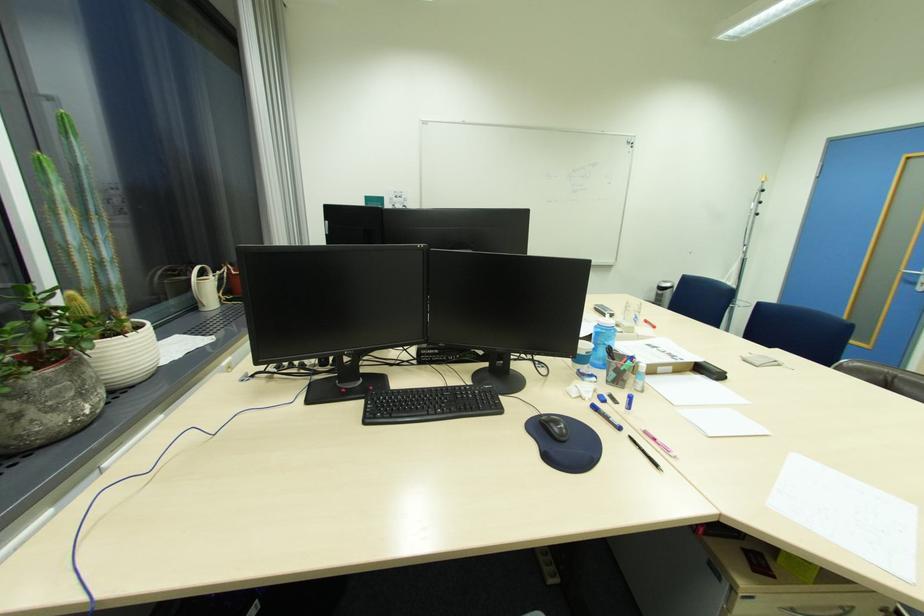
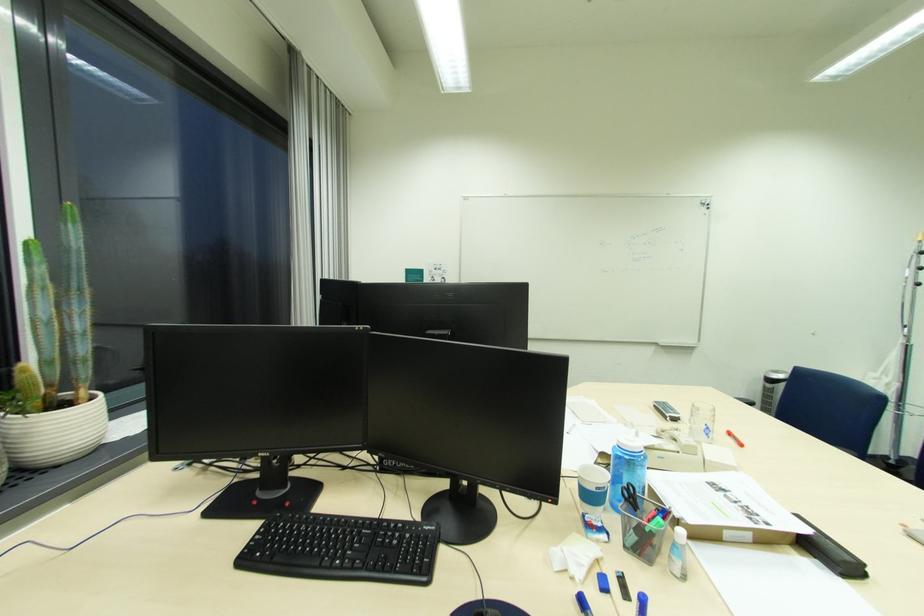
Locate, in the second image, the point that corresponds to point 624,403 in the first image.

(636, 601)